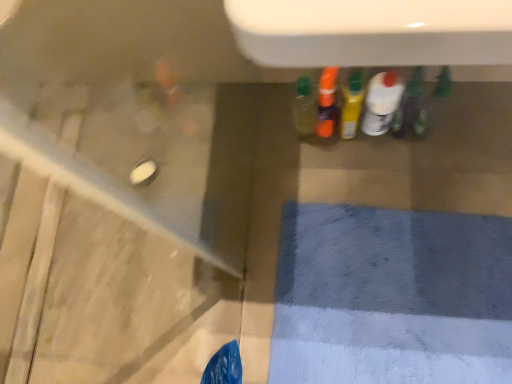
Question: Does green matte bottle at center, marked as the 1th bottle in a right-to-left arrangement, come behind white glossy bottle at center, the second bottle positioned from the right?

Choices:
 (A) no
 (B) yes

Answer: (A)

Question: Is green matte bottle at center, marked as the 1th bottle in a right-to-left arrangement, wider than white glossy bottle at center, the second bottle positioned from the right?

Choices:
 (A) no
 (B) yes

Answer: (B)

Question: Does green matte bottle at center, marked as the 1th bottle in a right-to-left arrangement, turn towards white glossy bottle at center, the fourth bottle positioned from the left?

Choices:
 (A) yes
 (B) no

Answer: (B)

Question: Can you confirm if green matte bottle at center, marked as the 1th bottle in a right-to-left arrangement, is thinner than white glossy bottle at center, the second bottle positioned from the right?

Choices:
 (A) no
 (B) yes

Answer: (A)

Question: Can you confirm if green matte bottle at center, which ranks as the 5th bottle in left-to-right order, is positioned to the right of white glossy bottle at center, the second bottle positioned from the right?

Choices:
 (A) yes
 (B) no

Answer: (A)

Question: In terms of height, does translucent plastic bottle at center, arranged as the third bottle when viewed from the right, look taller or shorter compared to translucent plastic bottle at center, the fifth bottle positioned from the right?

Choices:
 (A) tall
 (B) short

Answer: (B)

Question: Do you think translucent plastic bottle at center, arranged as the third bottle when viewed from the right, is within translucent plastic bottle at center, placed as the first bottle when sorted from left to right, or outside of it?

Choices:
 (A) inside
 (B) outside

Answer: (B)

Question: Considering the positions of point (353, 107) and point (311, 91), is point (353, 107) closer or farther from the camera than point (311, 91)?

Choices:
 (A) closer
 (B) farther

Answer: (B)

Question: In the image, is translucent plastic bottle at center, arranged as the third bottle when viewed from the right, positioned in front of or behind translucent plastic bottle at center, placed as the first bottle when sorted from left to right?

Choices:
 (A) behind
 (B) front

Answer: (B)

Question: Based on their positions, is translucent orange bottle at center, the 2th bottle when ordered from left to right, located to the left or right of green matte bottle at center, which ranks as the 5th bottle in left-to-right order?

Choices:
 (A) left
 (B) right

Answer: (A)

Question: Considering the positions of point (331, 109) and point (417, 97), is point (331, 109) closer or farther from the camera than point (417, 97)?

Choices:
 (A) farther
 (B) closer

Answer: (B)

Question: From a real-world perspective, is translucent orange bottle at center, the fourth bottle positioned from the right, positioned above or below green matte bottle at center, which ranks as the 5th bottle in left-to-right order?

Choices:
 (A) below
 (B) above

Answer: (A)

Question: Looking at the image, does translucent orange bottle at center, the 2th bottle when ordered from left to right, seem bigger or smaller compared to green matte bottle at center, which ranks as the 5th bottle in left-to-right order?

Choices:
 (A) big
 (B) small

Answer: (A)

Question: Which is correct: white glossy bottle at center, the fourth bottle positioned from the left, is inside green matte bottle at center, marked as the 1th bottle in a right-to-left arrangement, or outside of it?

Choices:
 (A) outside
 (B) inside

Answer: (A)

Question: From the image's perspective, relative to green matte bottle at center, marked as the 1th bottle in a right-to-left arrangement, is white glossy bottle at center, the fourth bottle positioned from the left, above or below?

Choices:
 (A) above
 (B) below

Answer: (A)